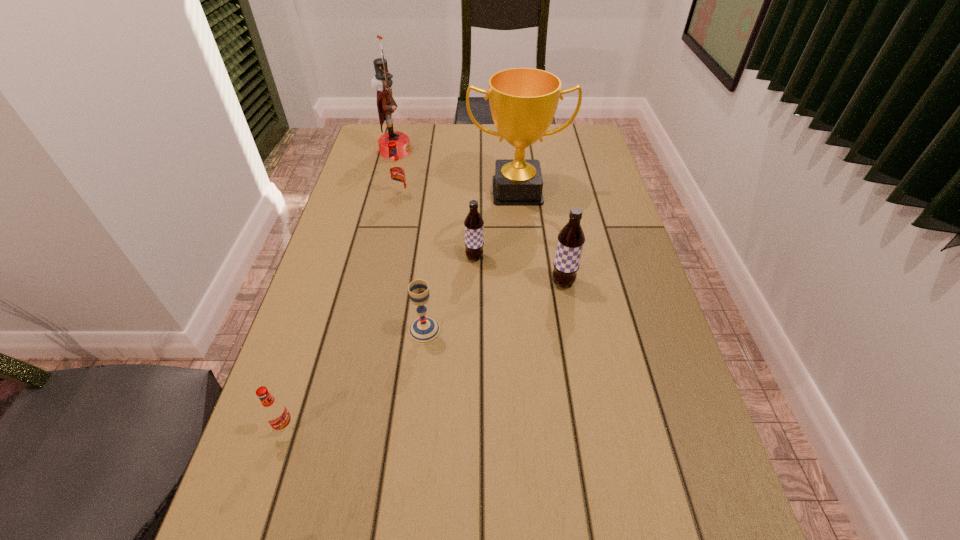
The width and height of the screenshot is (960, 540). Identify the location of gray chalice. (424, 330).

Find the location of a particular element. the nearer red root beer is located at coordinates (275, 412).

At what (x,y) coordinates should I click in order to perform the action: click on the leftmost root beer. Please return your answer as a coordinate pair (x, y). The image size is (960, 540). Looking at the image, I should click on (275, 412).

Identify the location of free space located 0.290m on the front-facing side of the farthest object. The width and height of the screenshot is (960, 540). (493, 151).

In order to click on vacant space located 0.060m on the front-facing side of the award in this screenshot , I will do `click(520, 222)`.

This screenshot has width=960, height=540. I want to click on vacant space located 0.390m on the front of the second nearest root beer, so coord(592,448).

You are a GUI agent. You are given a task and a screenshot of the screen. Output one action in this format:
    pyautogui.click(x=<x>, y=<y>)
    Task: Click on the vacant space located on the back of the farthest root beer
    This screenshot has height=540, width=960.
    Given the screenshot: What is the action you would take?
    pyautogui.click(x=404, y=176)

Find the location of a particular element. The height and width of the screenshot is (540, 960). vacant space situated on the left of the left brown root beer is located at coordinates [x=325, y=258].

The image size is (960, 540). Identify the location of free space located 0.150m on the back of the gray chalice. (431, 272).

Locate an element on the screen. free space located on the back of the smaller red root beer is located at coordinates (317, 328).